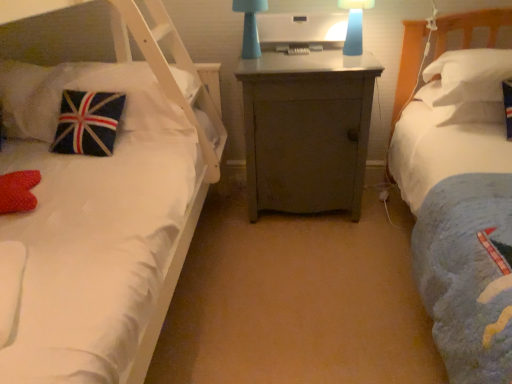
Measure the distance between point (332, 184) and camera.

The depth of point (332, 184) is 2.08 meters.

I want to click on blue matte lampshade at upper center, which is counted as the first bedside lamp, starting from the right, so click(354, 25).

What do you see at coordinates (354, 25) in the screenshot? I see `blue matte lampshade at upper center, which is counted as the first bedside lamp, starting from the right` at bounding box center [354, 25].

The width and height of the screenshot is (512, 384). What do you see at coordinates (465, 103) in the screenshot? I see `white soft pillow at right, placed as the second pillow when sorted from left to right` at bounding box center [465, 103].

This screenshot has width=512, height=384. Describe the element at coordinates (83, 90) in the screenshot. I see `velvet union jack pillow at left, positioned as the 3th pillow in right-to-left order` at that location.

How much space does white soft pillow at right, positioned as the first pillow in right-to-left order, occupy vertically?

It is 8.40 inches.

This screenshot has height=384, width=512. In order to click on gray matte cabinet at center in this screenshot , I will do `click(307, 130)`.

From the image's perspective, is white soft pillow at right, which is counted as the second pillow, starting from the right, above or below velvet union jack pillow at left, positioned as the 3th pillow in right-to-left order?

Based on their image positions, white soft pillow at right, which is counted as the second pillow, starting from the right, is located above velvet union jack pillow at left, positioned as the 3th pillow in right-to-left order.

From a real-world perspective, which object stands above the other?

velvet union jack pillow at left, which is counted as the 1th pillow, starting from the left, from a real-world perspective.

This screenshot has width=512, height=384. I want to click on pillow below the white soft pillow at right, placed as the second pillow when sorted from left to right (from the image's perspective), so click(83, 90).

From the image's perspective, which is above, blue matte lampshade at upper center, which is counted as the first bedside lamp, starting from the right, or white soft pillow at right, which is counted as the second pillow, starting from the right?

From the image's view, blue matte lampshade at upper center, which is counted as the first bedside lamp, starting from the right, is above.

Between point (356, 45) and point (455, 121), which one is positioned in front?

The point (455, 121) is more forward.

Between blue matte lampshade at upper center, which is counted as the first bedside lamp, starting from the right, and white soft pillow at right, which is counted as the second pillow, starting from the right, which one has smaller width?

With smaller width is blue matte lampshade at upper center, which is counted as the first bedside lamp, starting from the right.

From the image's perspective, which bedside lamp is the 2nd one above the gray matte cabinet at center? Please provide its 2D coordinates.

[(250, 25)]

Looking at this image, does matte blue lamp at center, the second bedside lamp when ordered from right to left, contain gray matte cabinet at center?

No, gray matte cabinet at center is not inside matte blue lamp at center, the second bedside lamp when ordered from right to left.

Which of these two, matte blue lamp at center, placed as the 1th bedside lamp when sorted from left to right, or gray matte cabinet at center, is thinner?

With smaller width is matte blue lamp at center, placed as the 1th bedside lamp when sorted from left to right.

Could you tell me if matte blue lamp at center, the second bedside lamp when ordered from right to left, is facing gray matte cabinet at center?

No, matte blue lamp at center, the second bedside lamp when ordered from right to left, is not turned towards gray matte cabinet at center.

Can you see matte blue lamp at center, the second bedside lamp when ordered from right to left, touching white soft pillow at right, positioned as the first pillow in right-to-left order?

There is a gap between matte blue lamp at center, the second bedside lamp when ordered from right to left, and white soft pillow at right, positioned as the first pillow in right-to-left order.

Is matte blue lamp at center, placed as the 1th bedside lamp when sorted from left to right, oriented away from white soft pillow at right, positioned as the first pillow in right-to-left order?

matte blue lamp at center, placed as the 1th bedside lamp when sorted from left to right, does not have its back to white soft pillow at right, positioned as the first pillow in right-to-left order.

From the image's perspective, is matte blue lamp at center, the second bedside lamp when ordered from right to left, on white soft pillow at right, positioned as the first pillow in right-to-left order?

Correct, matte blue lamp at center, the second bedside lamp when ordered from right to left, appears higher than white soft pillow at right, positioned as the first pillow in right-to-left order, in the image.

How much distance is there between matte blue lamp at center, placed as the 1th bedside lamp when sorted from left to right, and white soft pillow at right, positioned as the first pillow in right-to-left order?

A distance of 36.79 inches exists between matte blue lamp at center, placed as the 1th bedside lamp when sorted from left to right, and white soft pillow at right, positioned as the first pillow in right-to-left order.

Identify the location of bedside lamp located behind the blue matte lampshade at upper center, which ranks as the second bedside lamp in left-to-right order. The image size is (512, 384). (250, 25).

Is matte blue lamp at center, placed as the 1th bedside lamp when sorted from left to right, facing away from blue matte lampshade at upper center, which is counted as the first bedside lamp, starting from the right?

No, matte blue lamp at center, placed as the 1th bedside lamp when sorted from left to right, is not facing the opposite direction of blue matte lampshade at upper center, which is counted as the first bedside lamp, starting from the right.

Considering the sizes of objects matte blue lamp at center, placed as the 1th bedside lamp when sorted from left to right, and blue matte lampshade at upper center, which is counted as the first bedside lamp, starting from the right, in the image provided, who is shorter, matte blue lamp at center, placed as the 1th bedside lamp when sorted from left to right, or blue matte lampshade at upper center, which is counted as the first bedside lamp, starting from the right,?

With less height is blue matte lampshade at upper center, which is counted as the first bedside lamp, starting from the right.

Which of these two, matte blue lamp at center, the second bedside lamp when ordered from right to left, or blue matte lampshade at upper center, which is counted as the first bedside lamp, starting from the right, is thinner?

Thinner between the two is blue matte lampshade at upper center, which is counted as the first bedside lamp, starting from the right.

Image resolution: width=512 pixels, height=384 pixels. In order to click on pillow above the white soft pillow at right, placed as the second pillow when sorted from left to right (from the image's perspective) in this screenshot , I will do `click(467, 76)`.

Between white soft pillow at right, the third pillow when ordered from left to right, and white soft pillow at right, placed as the second pillow when sorted from left to right, which one is positioned behind?

white soft pillow at right, placed as the second pillow when sorted from left to right, is further from the camera.

Which object is thinner, white soft pillow at right, positioned as the first pillow in right-to-left order, or white soft pillow at right, which is counted as the second pillow, starting from the right?

Thinner between the two is white soft pillow at right, positioned as the first pillow in right-to-left order.

Can we say white soft pillow at right, the third pillow when ordered from left to right, lies outside white soft pillow at right, which is counted as the second pillow, starting from the right?

white soft pillow at right, the third pillow when ordered from left to right, lies outside white soft pillow at right, which is counted as the second pillow, starting from the right,'s area.

Considering the points (263, 6) and (129, 70), which point is in front, point (263, 6) or point (129, 70)?

The point (263, 6) is closer to the camera.

Is matte blue lamp at center, the second bedside lamp when ordered from right to left, to the left of velvet union jack pillow at left, positioned as the 3th pillow in right-to-left order, from the viewer's perspective?

No, matte blue lamp at center, the second bedside lamp when ordered from right to left, is not to the left of velvet union jack pillow at left, positioned as the 3th pillow in right-to-left order.

Considering the sizes of objects matte blue lamp at center, the second bedside lamp when ordered from right to left, and velvet union jack pillow at left, which is counted as the 1th pillow, starting from the left, in the image provided, who is wider, matte blue lamp at center, the second bedside lamp when ordered from right to left, or velvet union jack pillow at left, which is counted as the 1th pillow, starting from the left,?

velvet union jack pillow at left, which is counted as the 1th pillow, starting from the left.

Are matte blue lamp at center, placed as the 1th bedside lamp when sorted from left to right, and velvet union jack pillow at left, positioned as the 3th pillow in right-to-left order, located far from each other?

No, matte blue lamp at center, placed as the 1th bedside lamp when sorted from left to right, is in close proximity to velvet union jack pillow at left, positioned as the 3th pillow in right-to-left order.

Locate an element on the screen. Image resolution: width=512 pixels, height=384 pixels. the 1st pillow above the velvet union jack pillow at left, positioned as the 3th pillow in right-to-left order (from the image's perspective) is located at coordinates (465, 103).

Locate an element on the screen. This screenshot has height=384, width=512. bedside lamp that is the 1st object to the left of the white soft pillow at right, placed as the second pillow when sorted from left to right, starting at the anchor is located at coordinates (354, 25).

When comparing their distances from white soft pillow at right, which is counted as the second pillow, starting from the right, does gray matte cabinet at center or white soft pillow at right, the third pillow when ordered from left to right, seem closer?

Based on the image, white soft pillow at right, the third pillow when ordered from left to right, appears to be nearer to white soft pillow at right, which is counted as the second pillow, starting from the right.

Which object lies nearer to the anchor point white soft pillow at right, the third pillow when ordered from left to right, matte blue lamp at center, placed as the 1th bedside lamp when sorted from left to right, or velvet union jack pillow at left, which is counted as the 1th pillow, starting from the left?

→ Among the two, matte blue lamp at center, placed as the 1th bedside lamp when sorted from left to right, is located nearer to white soft pillow at right, the third pillow when ordered from left to right.

Based on the photo, looking at the image, which one is located closer to gray matte cabinet at center, velvet union jack pillow at left, which is counted as the 1th pillow, starting from the left, or matte blue lamp at center, the second bedside lamp when ordered from right to left?

Among the two, matte blue lamp at center, the second bedside lamp when ordered from right to left, is located nearer to gray matte cabinet at center.

Which object lies further to the anchor point velvet union jack pillow at left, positioned as the 3th pillow in right-to-left order, white soft pillow at right, which is counted as the second pillow, starting from the right, or blue matte lampshade at upper center, which ranks as the second bedside lamp in left-to-right order?

white soft pillow at right, which is counted as the second pillow, starting from the right, lies further to velvet union jack pillow at left, positioned as the 3th pillow in right-to-left order, than the other object.

Consider the image. Considering their positions, is blue matte lampshade at upper center, which ranks as the second bedside lamp in left-to-right order, positioned further to velvet union jack pillow at left, which is counted as the 1th pillow, starting from the left, than gray matte cabinet at center?

The object further to velvet union jack pillow at left, which is counted as the 1th pillow, starting from the left, is blue matte lampshade at upper center, which ranks as the second bedside lamp in left-to-right order.

From the image, which object appears to be nearer to matte blue lamp at center, the second bedside lamp when ordered from right to left, gray matte cabinet at center or velvet union jack pillow at left, positioned as the 3th pillow in right-to-left order?

gray matte cabinet at center is positioned closer to the anchor matte blue lamp at center, the second bedside lamp when ordered from right to left.

Estimate the real-world distances between objects in this image. Which object is closer to white soft pillow at right, placed as the second pillow when sorted from left to right, blue matte lampshade at upper center, which is counted as the first bedside lamp, starting from the right, or velvet union jack pillow at left, positioned as the 3th pillow in right-to-left order?

blue matte lampshade at upper center, which is counted as the first bedside lamp, starting from the right, lies closer to white soft pillow at right, placed as the second pillow when sorted from left to right, than the other object.

From the image, which object appears to be farther from gray matte cabinet at center, blue matte lampshade at upper center, which ranks as the second bedside lamp in left-to-right order, or matte blue lamp at center, placed as the 1th bedside lamp when sorted from left to right?

blue matte lampshade at upper center, which ranks as the second bedside lamp in left-to-right order, lies further to gray matte cabinet at center than the other object.

Locate an element on the screen. The image size is (512, 384). pillow between velvet union jack pillow at left, which is counted as the 1th pillow, starting from the left, and white soft pillow at right, the third pillow when ordered from left to right, from left to right is located at coordinates (465, 103).

Find the location of `nightstand situated between velvet union jack pillow at left, positioned as the 3th pillow in right-to-left order, and white soft pillow at right, the third pillow when ordered from left to right, from left to right`. nightstand situated between velvet union jack pillow at left, positioned as the 3th pillow in right-to-left order, and white soft pillow at right, the third pillow when ordered from left to right, from left to right is located at coordinates (307, 130).

Locate an element on the screen. pillow located between blue matte lampshade at upper center, which is counted as the first bedside lamp, starting from the right, and white soft pillow at right, the third pillow when ordered from left to right, in the left-right direction is located at coordinates (465, 103).

Identify the location of bedside lamp between velvet union jack pillow at left, positioned as the 3th pillow in right-to-left order, and gray matte cabinet at center, in the horizontal direction. (250, 25).